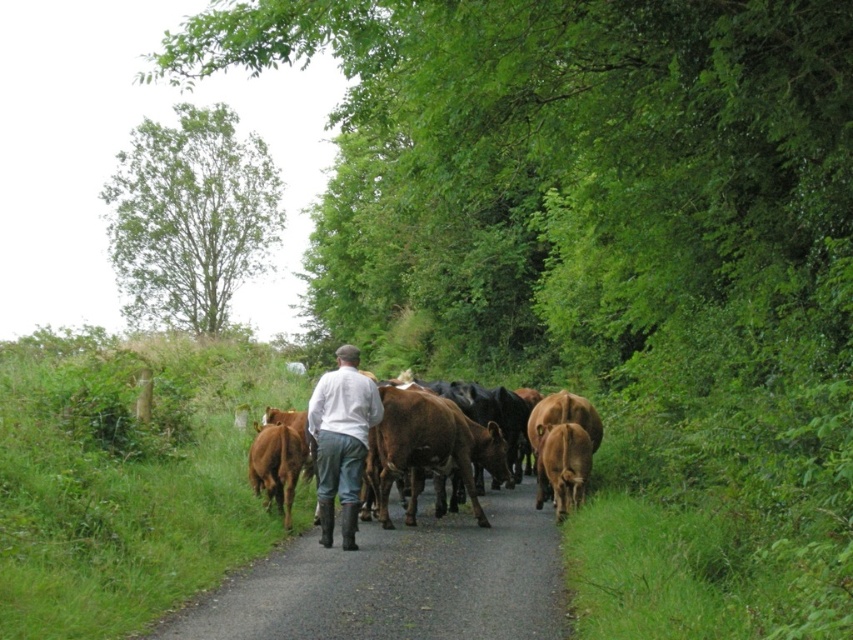
Which is below, smooth asphalt road at center or white cotton shirt at center?

smooth asphalt road at center

Does point (512, 552) come closer to viewer compared to point (332, 385)?

Yes, it is in front of point (332, 385).

Measure the distance between smooth asphalt road at center and camera.

The distance of smooth asphalt road at center from camera is 6.08 meters.

At what (x,y) coordinates should I click in order to perform the action: click on smooth asphalt road at center. Please return your answer as a coordinate pair (x, y). The width and height of the screenshot is (853, 640). Looking at the image, I should click on (397, 582).

Is green leafy tree at upper left shorter than white cotton shirt at center?

No, green leafy tree at upper left is not shorter than white cotton shirt at center.

Between green leafy tree at upper left and white cotton shirt at center, which one is positioned lower?

Positioned lower is white cotton shirt at center.

Which is in front, point (241, 282) or point (329, 381)?

Positioned in front is point (329, 381).

Locate an element on the screen. green leafy tree at upper left is located at coordinates (190, 218).

Consider the image. Does smooth asphalt road at center have a smaller size compared to brown glossy cows at center?

Correct, smooth asphalt road at center occupies less space than brown glossy cows at center.

Does point (339, 611) come closer to viewer compared to point (334, 428)?

Yes, it is.

Measure the distance between smooth asphalt road at center and camera.

smooth asphalt road at center and camera are 6.08 meters apart from each other.

I want to click on smooth asphalt road at center, so click(x=397, y=582).